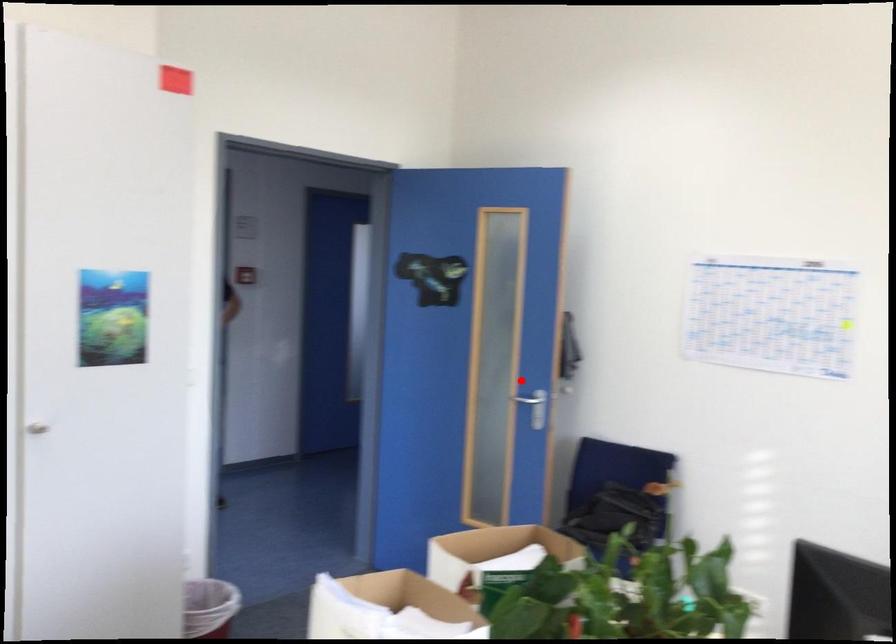
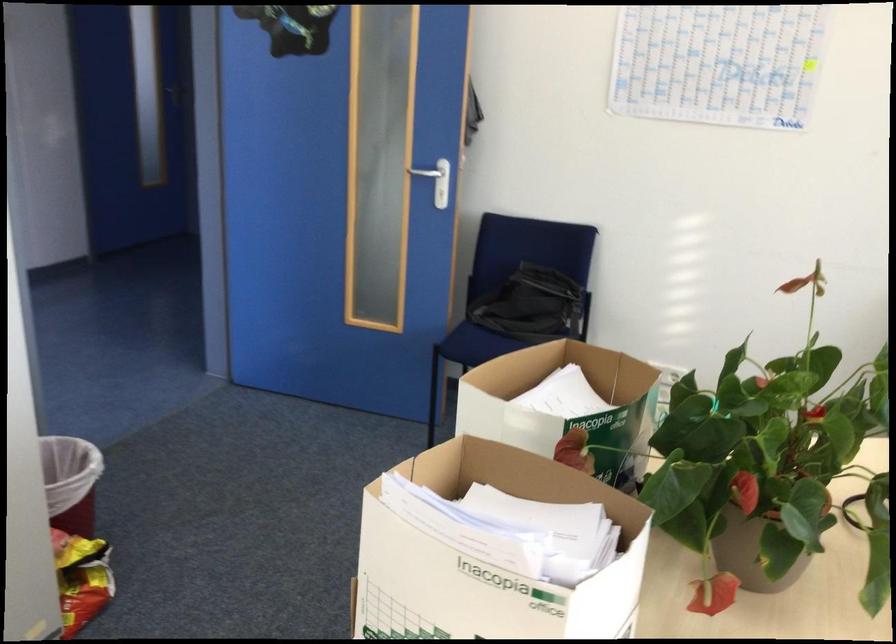
Question: A red point is marked in image1. In image2, is the corresponding 3D point closer to the camera or farther? Reply with the corresponding letter.

Choices:
 (A) The corresponding 3D point is closer.
 (B) The corresponding 3D point is farther.

Answer: (A)